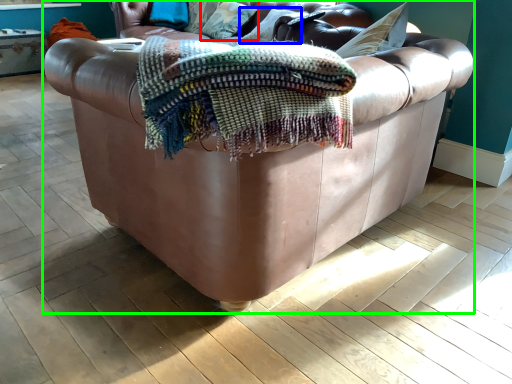
Question: Which object is positioned farthest from pillow (highlighted by a red box)? Select from pillow (highlighted by a blue box) and studio couch (highlighted by a green box).

Choices:
 (A) pillow
 (B) studio couch

Answer: (B)